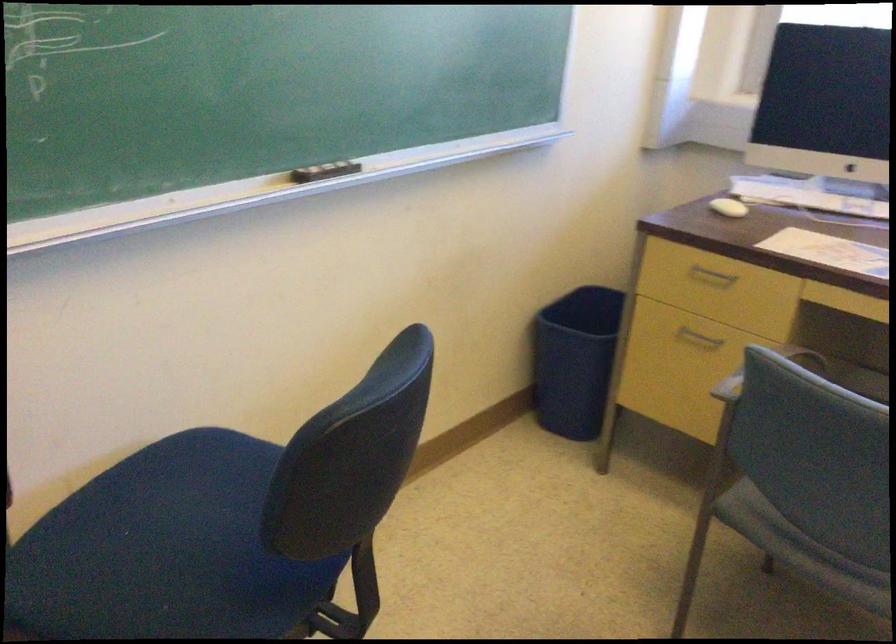
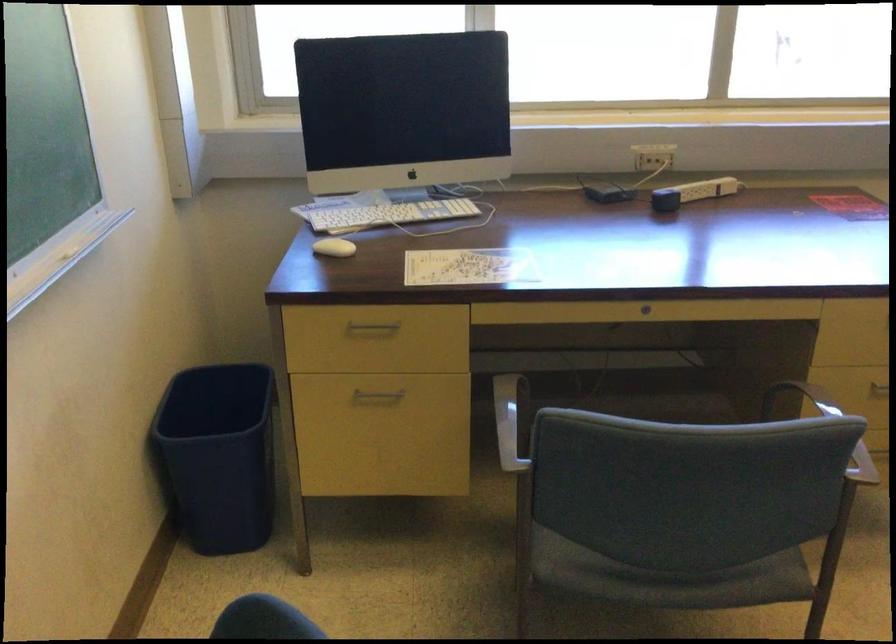
Locate, in the second image, the point that corresponds to (719,272) in the first image.

(373, 327)